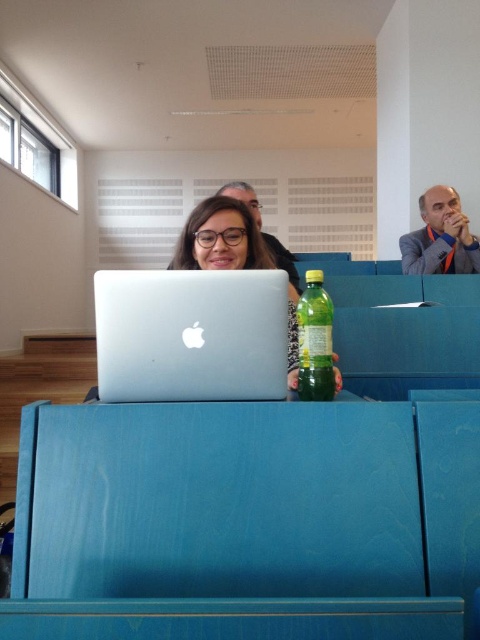
Question: Can you confirm if matte black man at upper right is positioned below matte black laptop at center?

Choices:
 (A) no
 (B) yes

Answer: (A)

Question: Which point appears closest to the camera in this image?

Choices:
 (A) (430, 218)
 (B) (250, 305)
 (C) (214, 218)

Answer: (B)

Question: Which of these objects is positioned farthest from the matte black laptop at center?

Choices:
 (A) green translucent bottle at center
 (B) matte black man at upper right

Answer: (A)

Question: Which of these objects is positioned closest to the matte black laptop at center?

Choices:
 (A) sleek silver laptop at center
 (B) matte black man at upper right
 (C) green translucent bottle at center
 (D) matte silver laptop at center

Answer: (D)

Question: Is matte silver laptop at center thinner than green translucent bottle at center?

Choices:
 (A) no
 (B) yes

Answer: (A)

Question: Is matte black man at upper right positioned before green translucent bottle at center?

Choices:
 (A) yes
 (B) no

Answer: (B)